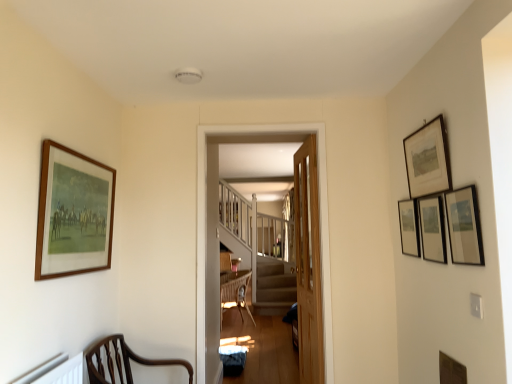
Question: Does light brown wooden door at center have a greater height compared to matte black picture frame at upper right, the fourth picture frame positioned from the left?

Choices:
 (A) yes
 (B) no

Answer: (A)

Question: Could matte black picture frame at upper right, the fourth picture frame positioned from the left, be considered to be inside light brown wooden door at center?

Choices:
 (A) yes
 (B) no

Answer: (B)

Question: Is light brown wooden door at center further to the viewer compared to matte black picture frame at upper right, the fourth picture frame positioned from the left?

Choices:
 (A) no
 (B) yes

Answer: (B)

Question: Does light brown wooden door at center have a greater width compared to matte black picture frame at upper right, the 3th picture frame positioned from the right?

Choices:
 (A) no
 (B) yes

Answer: (B)

Question: From a real-world perspective, is light brown wooden door at center physically above matte black picture frame at upper right, the 3th picture frame positioned from the right?

Choices:
 (A) no
 (B) yes

Answer: (A)

Question: From the image's perspective, is light brown wooden door at center positioned above or below wooden framed print at upper right, which ranks as the 5th picture frame in right-to-left order?

Choices:
 (A) below
 (B) above

Answer: (A)

Question: In terms of width, does light brown wooden door at center look wider or thinner when compared to wooden framed print at upper right, marked as the second picture frame in a left-to-right arrangement?

Choices:
 (A) thin
 (B) wide

Answer: (B)

Question: Is light brown wooden door at center inside or outside of wooden framed print at upper right, which ranks as the 5th picture frame in right-to-left order?

Choices:
 (A) outside
 (B) inside

Answer: (A)

Question: From their relative heights in the image, would you say light brown wooden door at center is taller or shorter than wooden framed print at upper right, which ranks as the 5th picture frame in right-to-left order?

Choices:
 (A) short
 (B) tall

Answer: (B)

Question: Choose the correct answer: Is wooden frame at left, positioned as the sixth picture frame in right-to-left order, inside matte black picture frame at upper right, the second picture frame positioned from the right, or outside it?

Choices:
 (A) inside
 (B) outside

Answer: (B)

Question: Based on their sizes in the image, would you say wooden frame at left, positioned as the sixth picture frame in right-to-left order, is bigger or smaller than matte black picture frame at upper right, the fifth picture frame from the left?

Choices:
 (A) small
 (B) big

Answer: (B)

Question: From a real-world perspective, is wooden frame at left, positioned as the sixth picture frame in right-to-left order, positioned above or below matte black picture frame at upper right, the second picture frame positioned from the right?

Choices:
 (A) above
 (B) below

Answer: (A)

Question: From the image's perspective, relative to matte black picture frame at upper right, the fifth picture frame from the left, is wooden frame at left, positioned as the sixth picture frame in right-to-left order, above or below?

Choices:
 (A) above
 (B) below

Answer: (A)

Question: In terms of height, does brown wood chair at lower left look taller or shorter compared to wooden frame at left, positioned as the sixth picture frame in right-to-left order?

Choices:
 (A) short
 (B) tall

Answer: (A)

Question: Looking at their shapes, would you say brown wood chair at lower left is wider or thinner than wooden frame at left, positioned as the 1th picture frame in left-to-right order?

Choices:
 (A) thin
 (B) wide

Answer: (B)